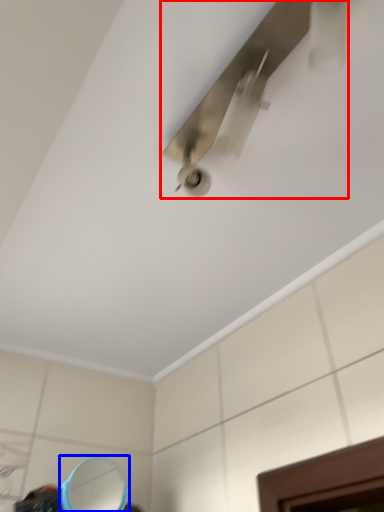
Question: Which point is further to the camera, ceiling fan (highlighted by a red box) or mirror (highlighted by a blue box)?

Choices:
 (A) ceiling fan
 (B) mirror

Answer: (B)